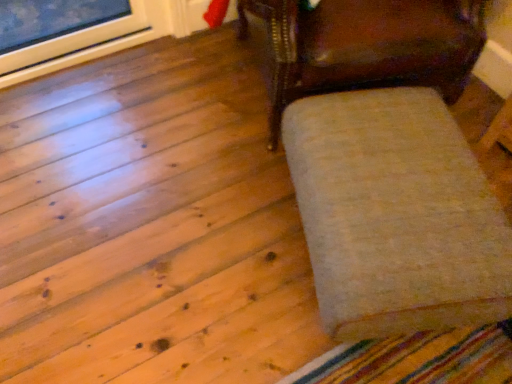
Question: From the image's perspective, is white fluffy ottoman at right above or below shiny dark wood chair at center?

Choices:
 (A) below
 (B) above

Answer: (A)

Question: Do you think white fluffy ottoman at right is within shiny dark wood chair at center, or outside of it?

Choices:
 (A) inside
 (B) outside

Answer: (B)

Question: In the image, is white fluffy ottoman at right positioned in front of or behind shiny dark wood chair at center?

Choices:
 (A) behind
 (B) front

Answer: (B)

Question: In the image, is shiny dark wood chair at center on the left side or the right side of white fluffy ottoman at right?

Choices:
 (A) right
 (B) left

Answer: (B)

Question: From their relative heights in the image, would you say shiny dark wood chair at center is taller or shorter than white fluffy ottoman at right?

Choices:
 (A) tall
 (B) short

Answer: (A)

Question: Does point [x=300, y=82] appear closer or farther from the camera than point [x=357, y=140]?

Choices:
 (A) closer
 (B) farther

Answer: (B)

Question: From the image's perspective, is shiny dark wood chair at center located above or below white fluffy ottoman at right?

Choices:
 (A) above
 (B) below

Answer: (A)